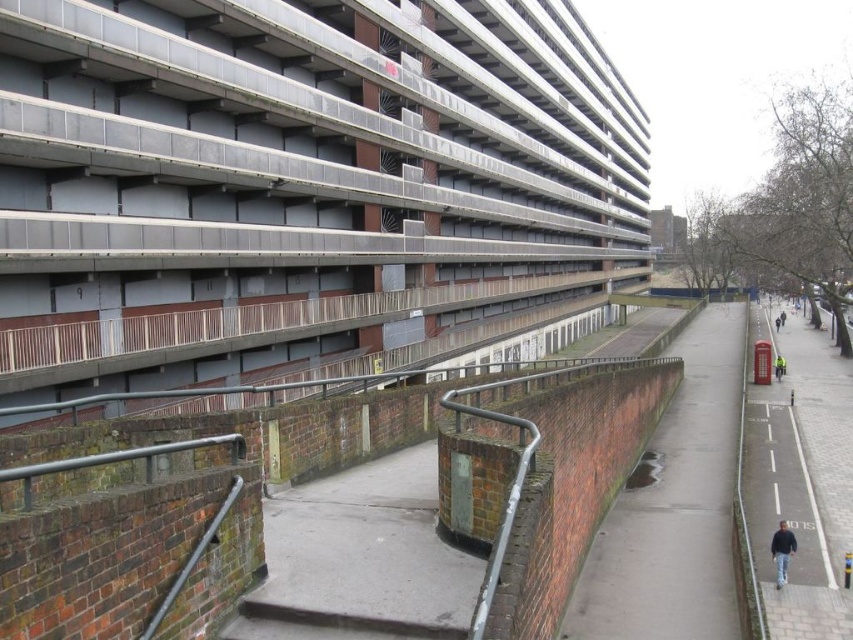
You are a pedestrian walking along the pathway in front of the residential building. You see the smooth concrete pavement at center and the yellow reflective jacket at right. Which object is located to the right of the other?

The yellow reflective jacket at right is located to the right of the smooth concrete pavement at center.

You are standing at the brick wall in the urban scene. You see two points marked on the pathway in front of you. The first point is at coordinate point(693,444) and the second point is at coordinate point(784,360). Which point is closer to you?

Point(693,444) is in front of point(784,360), so it is closer to you.

You are a pedestrian walking along the smooth concrete pavement at center. You notice the yellow reflective jacket at right. Based on the scene description, where is the yellow reflective jacket located relative to the pavement?

The yellow reflective jacket at right is above the smooth concrete pavement at center.